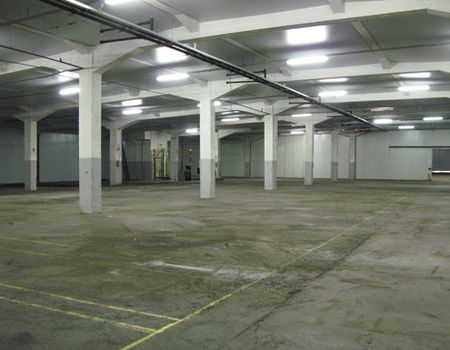
Where is `concrete floor`? concrete floor is located at coordinates (378, 286).